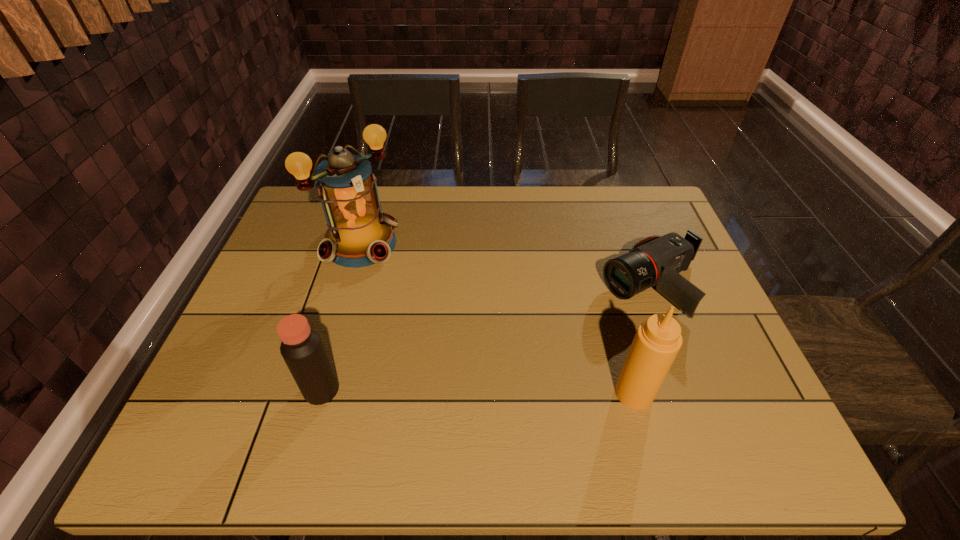
Image resolution: width=960 pixels, height=540 pixels. What are the coordinates of `free space on the desktop that is between the third tallest object and the condiment and is positioned on the front-facing side of the lantern` in the screenshot? It's located at (523, 392).

Identify the location of free spot on the desktop that is between the vinegar and the condiment and is positioned on the lens of the shortest object. (434, 392).